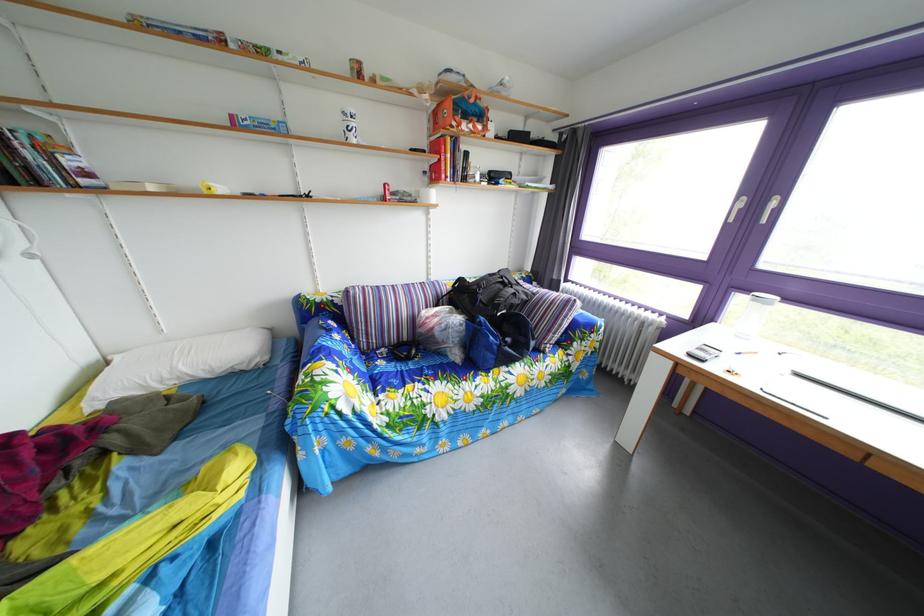
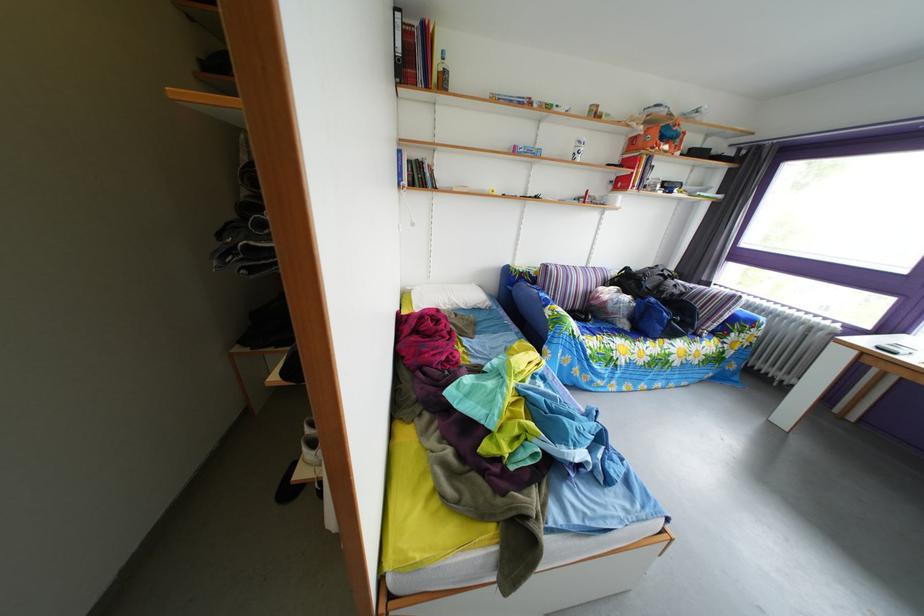
In the second image, find the point that corresponds to point (476, 124) in the first image.

(673, 147)